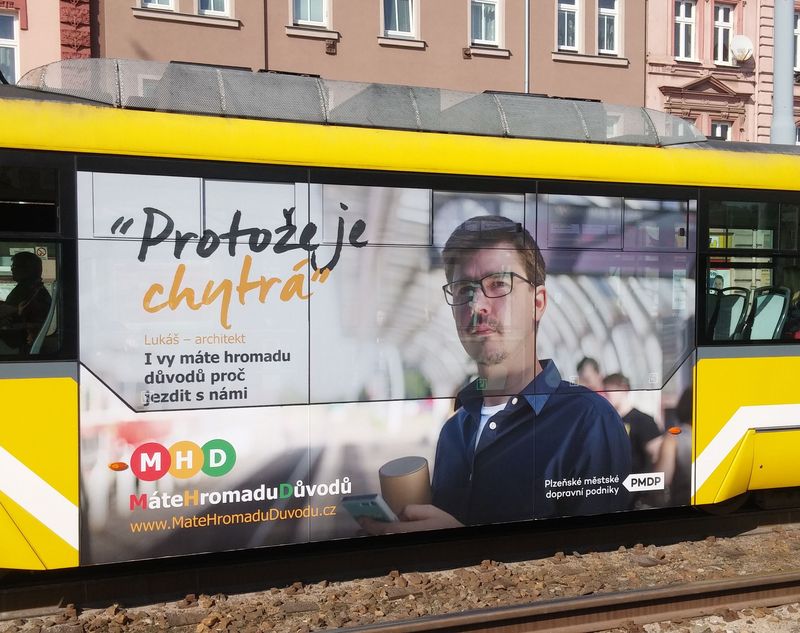
Find the location of a particular element. Image resolution: width=800 pixels, height=633 pixels. seats is located at coordinates click(x=734, y=311), click(x=762, y=318), click(x=42, y=329).